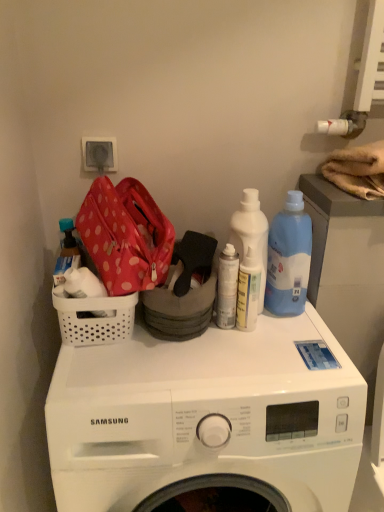
The width and height of the screenshot is (384, 512). I want to click on vacant space positioned to the left of translucent plastic spray bottle at center, which is counted as the 1th cleaning product, starting from the left, so click(155, 350).